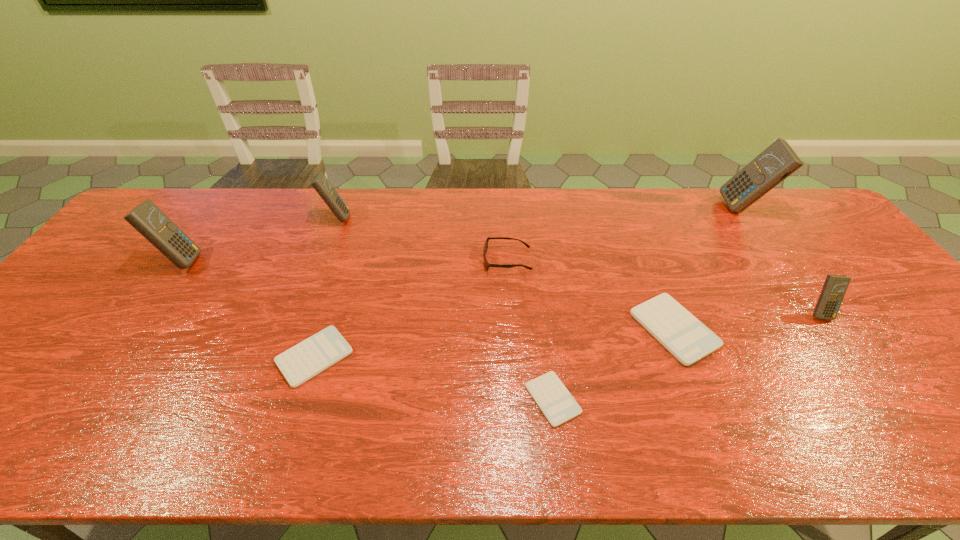
In order to click on the tallest calculator in this screenshot , I will do `click(778, 161)`.

Locate an element on the screen. Image resolution: width=960 pixels, height=540 pixels. the tallest object is located at coordinates (778, 161).

Where is `the sixth shortest calculator`? the sixth shortest calculator is located at coordinates point(151,222).

Identify the location of the leftmost blue calculator. The height and width of the screenshot is (540, 960). (151, 222).

Identify the location of the third biggest blue calculator. (320, 183).

This screenshot has width=960, height=540. I want to click on the fifth shortest calculator, so 320,183.

Where is `the fourth tallest calculator`? the fourth tallest calculator is located at coordinates (835, 286).

Locate an element on the screen. This screenshot has width=960, height=540. the smallest blue calculator is located at coordinates (835, 286).

Locate an element on the screen. The width and height of the screenshot is (960, 540). the fifth tallest object is located at coordinates (487, 264).

The width and height of the screenshot is (960, 540). I want to click on the sixth object from left to right, so click(x=682, y=334).